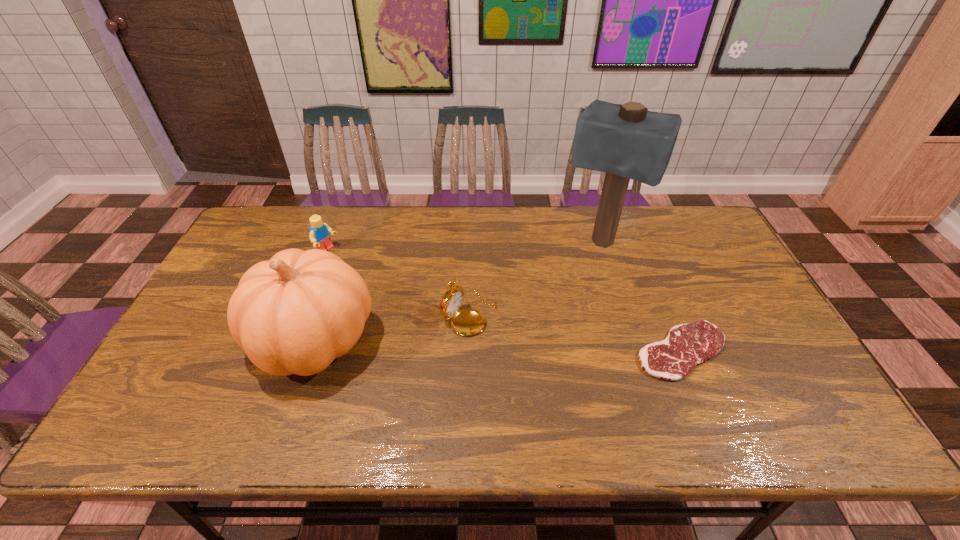
What are the coordinates of `free spot that satisfies the following two spatial constraints: 1. on the back side of the pumpkin; 2. on the left side of the third object from left to right` in the screenshot? It's located at (324, 313).